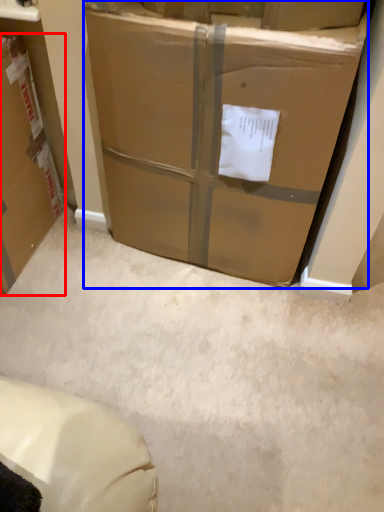
Question: Among these objects, which one is farthest to the camera, box (highlighted by a red box) or box (highlighted by a blue box)?

Choices:
 (A) box
 (B) box

Answer: (A)